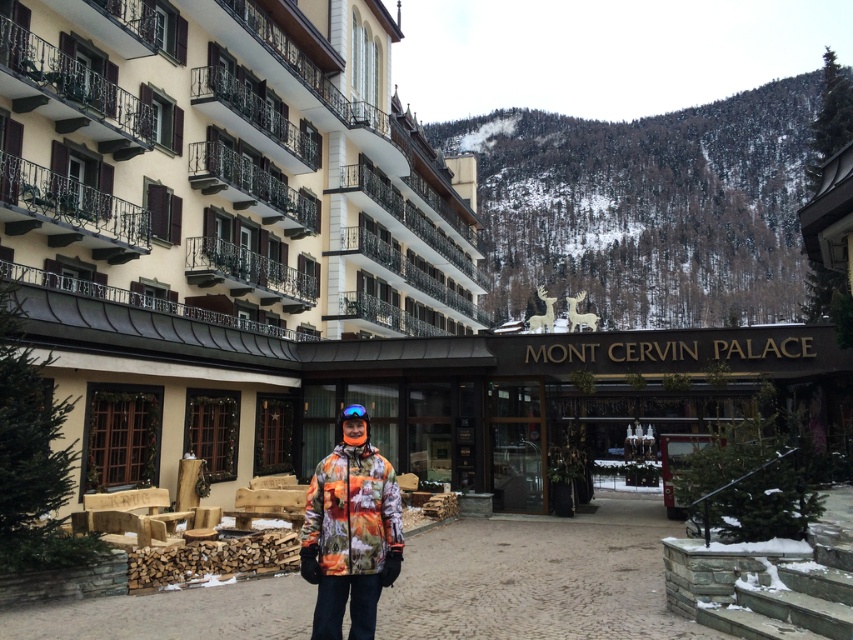
Does beige stone building at center appear on the right side of floral-patterned jacket at center?

Indeed, beige stone building at center is positioned on the right side of floral-patterned jacket at center.

Does point (105, 77) come behind point (320, 605)?

Yes, point (105, 77) is behind point (320, 605).

Identify the location of beige stone building at center. (215, 218).

Based on the photo, is floral-patterned jacket at center behind matte blue ski goggles at center?

No.

Measure the distance between floral-patterned jacket at center and camera.

floral-patterned jacket at center is 12.44 meters from camera.

This screenshot has width=853, height=640. What are the coordinates of `floral-patterned jacket at center` in the screenshot? It's located at (350, 532).

Who is positioned more to the left, beige stone building at center or matte blue ski goggles at center?

matte blue ski goggles at center

Who is taller, beige stone building at center or matte blue ski goggles at center?

beige stone building at center is taller.

Is point (357, 106) less distant than point (358, 410)?

No, (357, 106) is further to viewer.

Where is `beige stone building at center`? beige stone building at center is located at coordinates (215, 218).